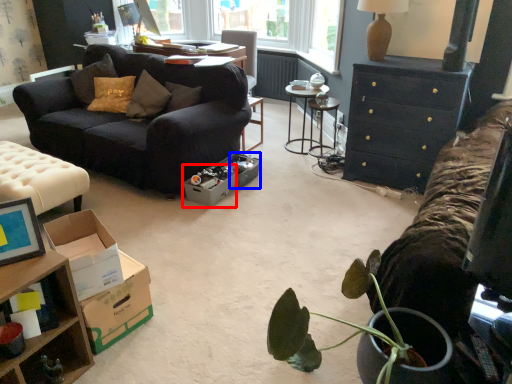
Question: Which of the following is the farthest to the observer, cardboard box (highlighted by a red box) or box (highlighted by a blue box)?

Choices:
 (A) cardboard box
 (B) box

Answer: (B)